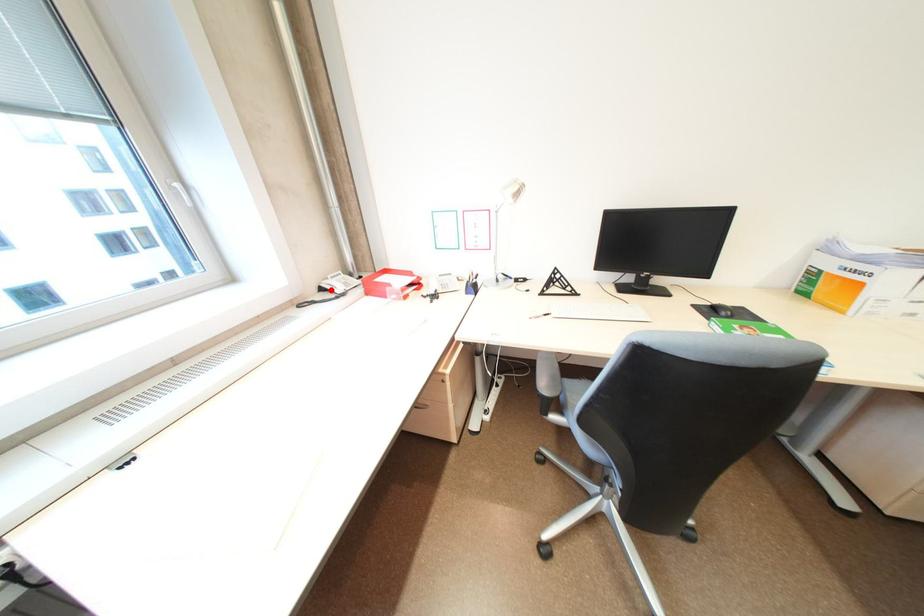
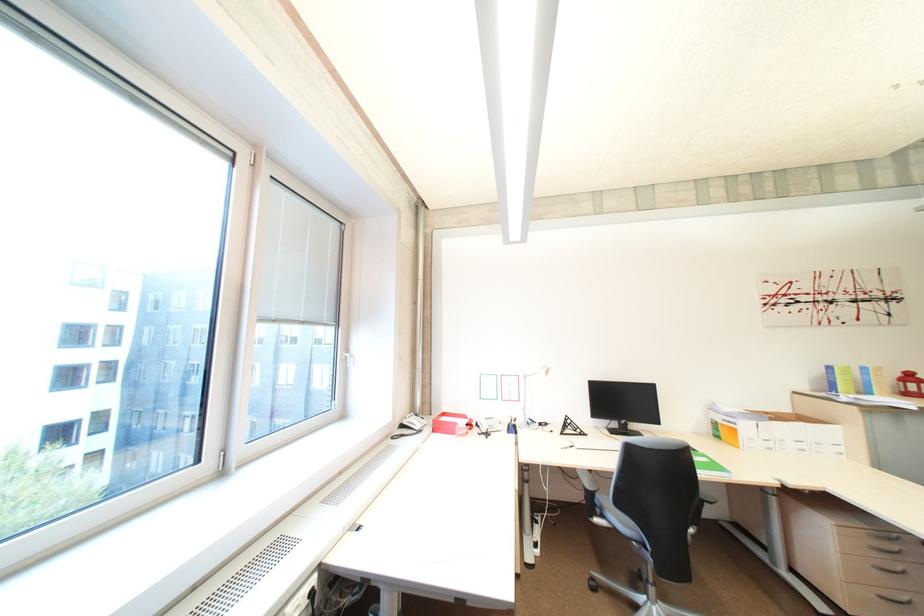
Question: I am providing you with two images of the same scene from different viewpoints. Image1 has a red point marked. In image2, the corresponding 3D location appears at what relative position? Reply with the corresponding letter.

Choices:
 (A) Closer
 (B) Farther

Answer: (B)